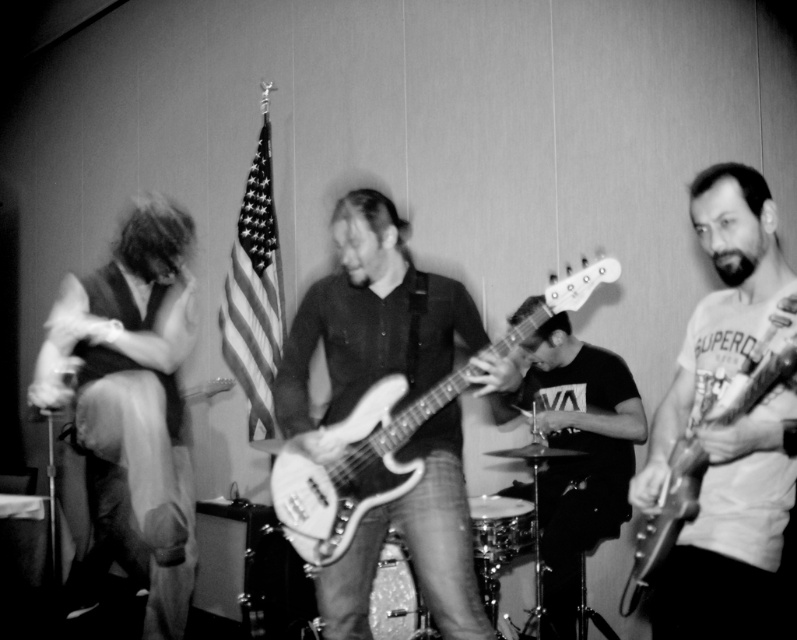
Question: Where is smooth fabric shirt at left located in relation to metallic silver guitar at right in the image?

Choices:
 (A) above
 (B) below

Answer: (B)

Question: Which point appears farthest from the camera in this image?

Choices:
 (A) (748, 388)
 (B) (307, 532)
 (C) (580, 589)

Answer: (C)

Question: Is smooth black shirt at center in front of metallic silver guitar at right?

Choices:
 (A) yes
 (B) no

Answer: (B)

Question: Does smooth fabric shirt at left have a greater width compared to smooth black shirt at center?

Choices:
 (A) no
 (B) yes

Answer: (A)

Question: Which of the following is the closest to the observer?

Choices:
 (A) (461, 385)
 (B) (646, 572)
 (C) (593, 368)
 (D) (159, 227)

Answer: (B)

Question: Which point is farther to the camera?

Choices:
 (A) (623, 588)
 (B) (587, 477)

Answer: (B)